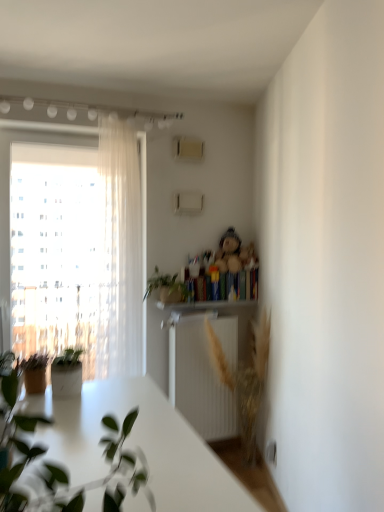
Question: Considering the relative positions of fluffy beige teddy bear at upper center and green matte plant at center, the 2th houseplant positioned from the front, in the image provided, is fluffy beige teddy bear at upper center to the left or to the right of green matte plant at center, the 2th houseplant positioned from the front,?

Choices:
 (A) right
 (B) left

Answer: (A)

Question: From a real-world perspective, relative to green matte plant at center, the 2th houseplant positioned from the front, is fluffy beige teddy bear at upper center vertically above or below?

Choices:
 (A) above
 (B) below

Answer: (A)

Question: Which object is positioned farthest from the fluffy beige teddy bear at upper center?

Choices:
 (A) wooden shelf at upper center
 (B) transparent glass window at left
 (C) green matte plant at center, which is counted as the first houseplant, starting from the back
 (D) green matte plant at left, positioned as the 1th houseplant in front-to-back order
 (E) sheer white curtain at left

Answer: (D)

Question: Considering the real-world distances, which object is farthest from the sheer white curtain at left?

Choices:
 (A) fluffy beige teddy bear at upper center
 (B) hardcover book at center
 (C) transparent glass window at left
 (D) green matte plant at center, which is counted as the first houseplant, starting from the back
 (E) green matte plant at left, marked as the 2th houseplant in a back-to-front arrangement

Answer: (E)